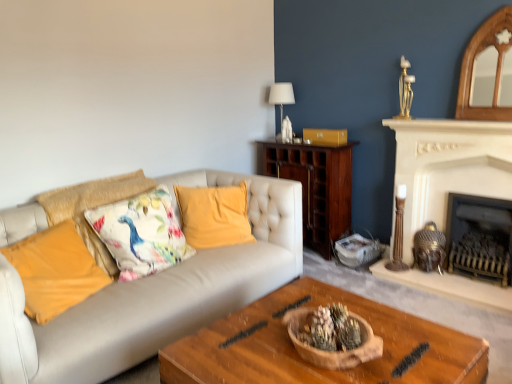
Measure the distance between point (282, 105) and camera.

3.99 meters.

The width and height of the screenshot is (512, 384). What are the coordinates of `yellow velvet pillow at center, which ranks as the first pillow in right-to-left order` in the screenshot? It's located at (214, 215).

Locate an element on the screen. black metal fireplace at right, the second fireplace in the left-to-right sequence is located at coordinates (479, 238).

Identify the location of floral fabric cushion at left, which is the second pillow in left-to-right order. The image size is (512, 384). (93, 208).

Considering the sizes of floral fabric cushion at center left, the 3th pillow in the left-to-right sequence, and white stone fireplace at upper right, the second fireplace positioned from the right, in the image, is floral fabric cushion at center left, the 3th pillow in the left-to-right sequence, taller or shorter than white stone fireplace at upper right, the second fireplace positioned from the right,?

floral fabric cushion at center left, the 3th pillow in the left-to-right sequence, is shorter than white stone fireplace at upper right, the second fireplace positioned from the right.

Looking at this image, considering the relative positions of floral fabric cushion at center left, the 2th pillow viewed from the right, and white stone fireplace at upper right, the second fireplace positioned from the right, in the image provided, is floral fabric cushion at center left, the 2th pillow viewed from the right, to the left of white stone fireplace at upper right, the second fireplace positioned from the right, from the viewer's perspective?

Correct, you'll find floral fabric cushion at center left, the 2th pillow viewed from the right, to the left of white stone fireplace at upper right, the second fireplace positioned from the right.

Are floral fabric cushion at center left, the 2th pillow viewed from the right, and white stone fireplace at upper right, placed as the first fireplace when sorted from left to right, beside each other?

floral fabric cushion at center left, the 2th pillow viewed from the right, is not next to white stone fireplace at upper right, placed as the first fireplace when sorted from left to right, and they're not touching.

Is floral fabric cushion at center left, the 2th pillow viewed from the right, shorter than white fabric lampshade at upper center?

No.

Between floral fabric cushion at center left, the 2th pillow viewed from the right, and white fabric lampshade at upper center, which one is positioned behind?

white fabric lampshade at upper center is behind.

Is floral fabric cushion at center left, the 2th pillow viewed from the right, facing towards white fabric lampshade at upper center?

No, floral fabric cushion at center left, the 2th pillow viewed from the right, is not oriented towards white fabric lampshade at upper center.

From the image's perspective, is floral fabric cushion at center left, the 3th pillow in the left-to-right sequence, above white fabric lampshade at upper center?

No, from the image's perspective, floral fabric cushion at center left, the 3th pillow in the left-to-right sequence, is not over white fabric lampshade at upper center.

Is floral fabric cushion at left, the third pillow when ordered from right to left, situated inside floral fabric cushion at center left, the 2th pillow viewed from the right, or outside?

floral fabric cushion at left, the third pillow when ordered from right to left, is spatially positioned inside floral fabric cushion at center left, the 2th pillow viewed from the right.

Consider the image. In terms of size, does floral fabric cushion at left, which is the second pillow in left-to-right order, appear bigger or smaller than floral fabric cushion at center left, the 3th pillow in the left-to-right sequence?

Considering their sizes, floral fabric cushion at left, which is the second pillow in left-to-right order, takes up more space than floral fabric cushion at center left, the 3th pillow in the left-to-right sequence.

Is floral fabric cushion at left, which is the second pillow in left-to-right order, next to floral fabric cushion at center left, the 3th pillow in the left-to-right sequence, and touching it?

No, floral fabric cushion at left, which is the second pillow in left-to-right order, is not next to floral fabric cushion at center left, the 3th pillow in the left-to-right sequence.

Which is correct: floral fabric cushion at center left, the 2th pillow viewed from the right, is inside dark wood cabinet at center, or outside of it?

floral fabric cushion at center left, the 2th pillow viewed from the right, exists outside the volume of dark wood cabinet at center.

Is floral fabric cushion at center left, the 2th pillow viewed from the right, in front of or behind dark wood cabinet at center in the image?

floral fabric cushion at center left, the 2th pillow viewed from the right, is in front of dark wood cabinet at center.

Is the surface of floral fabric cushion at center left, the 3th pillow in the left-to-right sequence, in direct contact with dark wood cabinet at center?

Answer: No, floral fabric cushion at center left, the 3th pillow in the left-to-right sequence, is not in contact with dark wood cabinet at center.

Is floral fabric cushion at center left, the 2th pillow viewed from the right, oriented towards dark wood cabinet at center?

No, floral fabric cushion at center left, the 2th pillow viewed from the right, is not facing towards dark wood cabinet at center.

Can you see black metal fireplace at right, acting as the first fireplace starting from the right, touching floral fabric cushion at left, which is the second pillow in left-to-right order?

No, black metal fireplace at right, acting as the first fireplace starting from the right, is not making contact with floral fabric cushion at left, which is the second pillow in left-to-right order.

Consider the image. From a real-world perspective, is black metal fireplace at right, the second fireplace in the left-to-right sequence, above or below floral fabric cushion at left, which is the second pillow in left-to-right order?

In terms of real-world spatial position, black metal fireplace at right, the second fireplace in the left-to-right sequence, is below floral fabric cushion at left, which is the second pillow in left-to-right order.

From the image's perspective, is black metal fireplace at right, acting as the first fireplace starting from the right, above or below floral fabric cushion at left, the third pillow when ordered from right to left?

black metal fireplace at right, acting as the first fireplace starting from the right, is below floral fabric cushion at left, the third pillow when ordered from right to left.

Looking at their sizes, would you say floral fabric cushion at center left, the 3th pillow in the left-to-right sequence, is wider or thinner than yellow velvet pillow at center, which ranks as the first pillow in right-to-left order?

Clearly, floral fabric cushion at center left, the 3th pillow in the left-to-right sequence, has more width compared to yellow velvet pillow at center, which ranks as the first pillow in right-to-left order.

Is floral fabric cushion at center left, the 3th pillow in the left-to-right sequence, to the left of yellow velvet pillow at center, which ranks as the 4th pillow in left-to-right order, from the viewer's perspective?

Yes, floral fabric cushion at center left, the 3th pillow in the left-to-right sequence, is to the left of yellow velvet pillow at center, which ranks as the 4th pillow in left-to-right order.

Consider the image. How different are the orientations of floral fabric cushion at center left, the 2th pillow viewed from the right, and yellow velvet pillow at center, which ranks as the 4th pillow in left-to-right order, in degrees?

There is a 39.8-degree angle between the facing directions of floral fabric cushion at center left, the 2th pillow viewed from the right, and yellow velvet pillow at center, which ranks as the 4th pillow in left-to-right order.

From the image's perspective, is floral fabric cushion at center left, the 2th pillow viewed from the right, positioned above or below yellow velvet pillow at center, which ranks as the first pillow in right-to-left order?

floral fabric cushion at center left, the 2th pillow viewed from the right, is below yellow velvet pillow at center, which ranks as the first pillow in right-to-left order.

You are a GUI agent. You are given a task and a screenshot of the screen. Output one action in this format:
    pyautogui.click(x=<x>, y=<y>)
    Task: Click on the cabinetry that is behind the yellow velvet pillow at center, which ranks as the 4th pillow in left-to-right order
    The height and width of the screenshot is (384, 512).
    Given the screenshot: What is the action you would take?
    pyautogui.click(x=315, y=187)

Which object is further away from the camera, yellow velvet pillow at center, which ranks as the first pillow in right-to-left order, or dark wood cabinet at center?

dark wood cabinet at center is further away from the camera.

Is yellow velvet pillow at center, which ranks as the 4th pillow in left-to-right order, thinner than dark wood cabinet at center?

Indeed, yellow velvet pillow at center, which ranks as the 4th pillow in left-to-right order, has a lesser width compared to dark wood cabinet at center.

This screenshot has height=384, width=512. What are the coordinates of `fireplace that is the 1st object directly below the floral fabric cushion at center left, the 3th pillow in the left-to-right sequence (from a real-world perspective)` in the screenshot? It's located at (448, 167).

This screenshot has height=384, width=512. What are the coordinates of `lamp above the floral fabric cushion at center left, the 2th pillow viewed from the right (from the image's perspective)` in the screenshot? It's located at (281, 95).

Based on their spatial positions, is floral fabric cushion at center left, the 3th pillow in the left-to-right sequence, or white stone fireplace at upper right, placed as the first fireplace when sorted from left to right, closer to floral fabric cushion at left, which is the second pillow in left-to-right order?

Among the two, floral fabric cushion at center left, the 3th pillow in the left-to-right sequence, is located nearer to floral fabric cushion at left, which is the second pillow in left-to-right order.

Looking at the image, which one is located further to floral fabric cushion at left, which is the second pillow in left-to-right order, white fabric lampshade at upper center or wooden coffee table at center?

Based on the image, white fabric lampshade at upper center appears to be further to floral fabric cushion at left, which is the second pillow in left-to-right order.

When comparing their distances from wooden coffee table at center, does white stone fireplace at upper right, placed as the first fireplace when sorted from left to right, or floral fabric cushion at center left, the 3th pillow in the left-to-right sequence, seem further?

white stone fireplace at upper right, placed as the first fireplace when sorted from left to right, is further to wooden coffee table at center.

From the image, which object appears to be nearer to white fabric lampshade at upper center, black metal fireplace at right, acting as the first fireplace starting from the right, or floral fabric cushion at left, the third pillow when ordered from right to left?

floral fabric cushion at left, the third pillow when ordered from right to left, is closer to white fabric lampshade at upper center.

From the picture: When comparing their distances from floral fabric cushion at center left, the 2th pillow viewed from the right, does yellow velvet pillow at center, which ranks as the 4th pillow in left-to-right order, or black metal fireplace at right, the second fireplace in the left-to-right sequence, seem closer?

yellow velvet pillow at center, which ranks as the 4th pillow in left-to-right order, lies closer to floral fabric cushion at center left, the 2th pillow viewed from the right, than the other object.

Based on their spatial positions, is yellow fabric pillow at left, the fourth pillow positioned from the right, or dark wood cabinet at center closer to floral fabric cushion at left, which is the second pillow in left-to-right order?

yellow fabric pillow at left, the fourth pillow positioned from the right.

Based on their spatial positions, is yellow fabric pillow at left, the fourth pillow positioned from the right, or floral fabric cushion at center left, the 2th pillow viewed from the right, closer to black metal fireplace at right, acting as the first fireplace starting from the right?

floral fabric cushion at center left, the 2th pillow viewed from the right, lies closer to black metal fireplace at right, acting as the first fireplace starting from the right, than the other object.

When comparing their distances from floral fabric cushion at center left, the 3th pillow in the left-to-right sequence, does floral fabric cushion at left, which is the second pillow in left-to-right order, or yellow velvet pillow at center, which ranks as the first pillow in right-to-left order, seem closer?

The object closer to floral fabric cushion at center left, the 3th pillow in the left-to-right sequence, is floral fabric cushion at left, which is the second pillow in left-to-right order.

Locate an element on the screen. fireplace between yellow velvet pillow at center, which ranks as the 4th pillow in left-to-right order, and black metal fireplace at right, the second fireplace in the left-to-right sequence is located at coordinates (448, 167).

Where is `coffee table between floral fabric cushion at center left, the 2th pillow viewed from the right, and white stone fireplace at upper right, the second fireplace positioned from the right, in the horizontal direction`? The height and width of the screenshot is (384, 512). coffee table between floral fabric cushion at center left, the 2th pillow viewed from the right, and white stone fireplace at upper right, the second fireplace positioned from the right, in the horizontal direction is located at coordinates (311, 364).

Where is `cabinetry between floral fabric cushion at center left, the 2th pillow viewed from the right, and black metal fireplace at right, acting as the first fireplace starting from the right, in the horizontal direction`? cabinetry between floral fabric cushion at center left, the 2th pillow viewed from the right, and black metal fireplace at right, acting as the first fireplace starting from the right, in the horizontal direction is located at coordinates (315, 187).

Locate an element on the screen. cabinetry between white fabric lampshade at upper center and yellow velvet pillow at center, which ranks as the 4th pillow in left-to-right order, in the vertical direction is located at coordinates (315, 187).